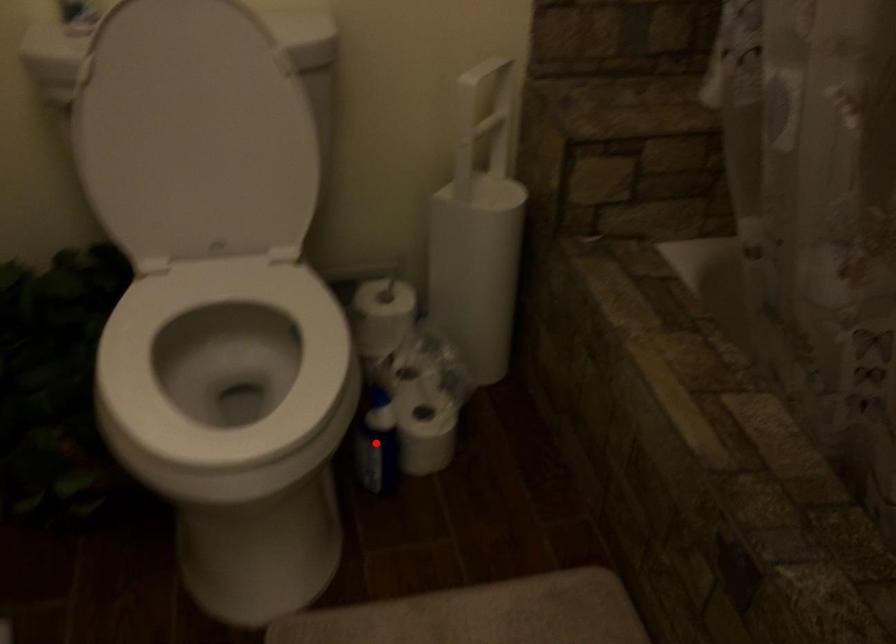
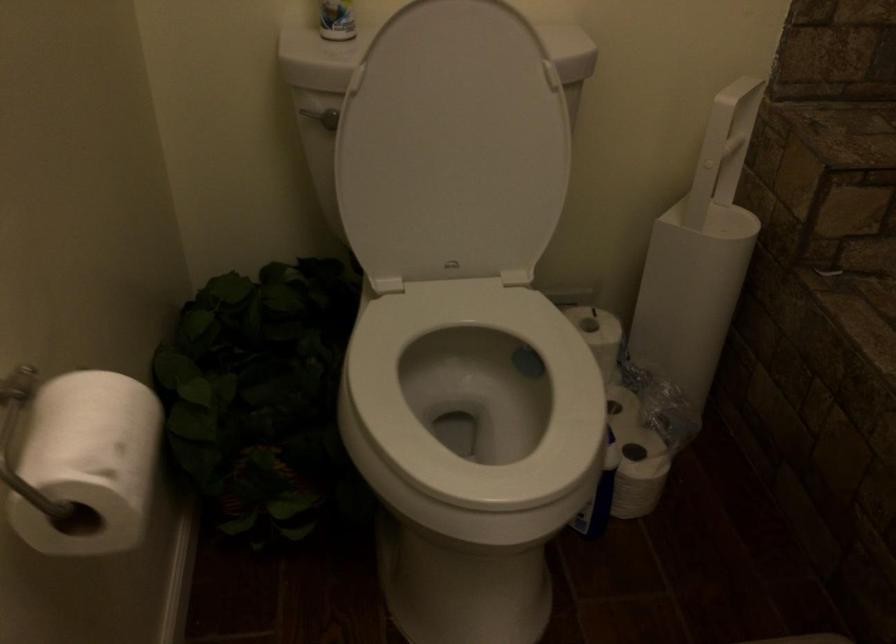
Question: I am providing you with two images of the same scene from different viewpoints. A red point is marked on the first image. Can you still see the location of the red point in image 2?

Choices:
 (A) Yes
 (B) No

Answer: (B)